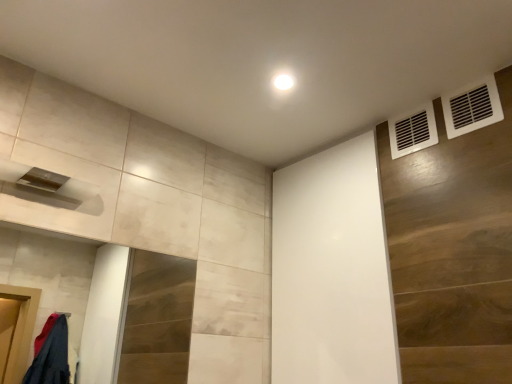
Question: Is white matte screen door at upper center facing away from white plastic vent at upper right, the second air conditioning in the front-to-back sequence?

Choices:
 (A) no
 (B) yes

Answer: (A)

Question: Is white matte screen door at upper center positioned behind white plastic vent at upper right, the second air conditioning in the front-to-back sequence?

Choices:
 (A) yes
 (B) no

Answer: (B)

Question: Is white matte screen door at upper center positioned in front of white plastic vent at upper right, positioned as the first air conditioning in left-to-right order?

Choices:
 (A) yes
 (B) no

Answer: (A)

Question: Considering the relative positions of white matte screen door at upper center and white plastic vent at upper right, positioned as the first air conditioning in left-to-right order, in the image provided, is white matte screen door at upper center to the right of white plastic vent at upper right, positioned as the first air conditioning in left-to-right order, from the viewer's perspective?

Choices:
 (A) yes
 (B) no

Answer: (B)

Question: Is white matte screen door at upper center at the left side of white plastic vent at upper right, the second air conditioning from the right?

Choices:
 (A) no
 (B) yes

Answer: (B)

Question: Can white plastic vent at upper right, positioned as the first air conditioning in left-to-right order, be found inside white matte screen door at upper center?

Choices:
 (A) no
 (B) yes

Answer: (A)

Question: Does white plastic vent at upper right, acting as the second air conditioning starting from the back, have a lesser width compared to white plastic vent at upper right, positioned as the first air conditioning in left-to-right order?

Choices:
 (A) no
 (B) yes

Answer: (A)

Question: Is white plastic vent at upper right, the first air conditioning when ordered from front to back, oriented away from white plastic vent at upper right, the 1th air conditioning from the back?

Choices:
 (A) no
 (B) yes

Answer: (A)

Question: From the image's perspective, does white plastic vent at upper right, the first air conditioning when ordered from front to back, appear lower than white plastic vent at upper right, the second air conditioning in the front-to-back sequence?

Choices:
 (A) no
 (B) yes

Answer: (A)

Question: Is white plastic vent at upper right, the first air conditioning when ordered from front to back, not close to white plastic vent at upper right, positioned as the first air conditioning in left-to-right order?

Choices:
 (A) no
 (B) yes

Answer: (A)

Question: Could you tell me if white plastic vent at upper right, which is the second air conditioning in left-to-right order, is turned towards white plastic vent at upper right, positioned as the first air conditioning in left-to-right order?

Choices:
 (A) yes
 (B) no

Answer: (B)

Question: Is white plastic vent at upper right, which is the second air conditioning in left-to-right order, further to the viewer compared to white plastic vent at upper right, the 1th air conditioning from the back?

Choices:
 (A) no
 (B) yes

Answer: (A)

Question: Is white plastic vent at upper right, the first air conditioning when ordered from front to back, positioned before white matte screen door at upper center?

Choices:
 (A) yes
 (B) no

Answer: (A)